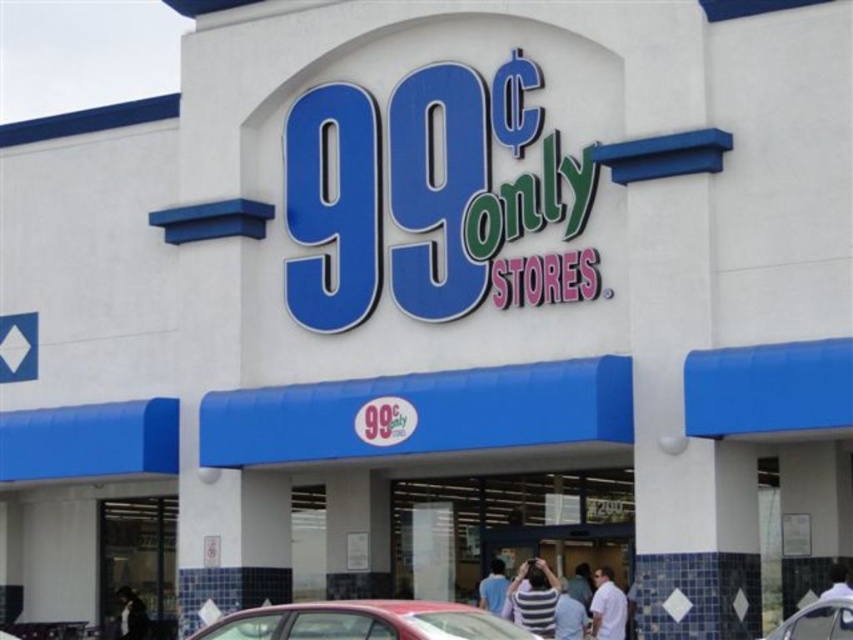
Question: Is metallic red car at lower center further to camera compared to blue shirt at center?

Choices:
 (A) no
 (B) yes

Answer: (A)

Question: Estimate the real-world distances between objects in this image. Which object is farther from the blue shirt at center?

Choices:
 (A) metallic red car at lower center
 (B) striped shirt at lower center

Answer: (A)

Question: Can you confirm if metallic silver car at lower right is positioned below striped shirt at center?

Choices:
 (A) no
 (B) yes

Answer: (A)

Question: Can you confirm if metallic red car at lower center is wider than metallic silver car at lower right?

Choices:
 (A) yes
 (B) no

Answer: (A)

Question: Which of the following is the closest to the observer?

Choices:
 (A) dark blue shirt at lower left
 (B) blue shirt at center

Answer: (B)

Question: Among these points, which one is nearest to the camera?

Choices:
 (A) (564, 620)
 (B) (817, 605)
 (C) (144, 611)
 (D) (334, 636)

Answer: (D)